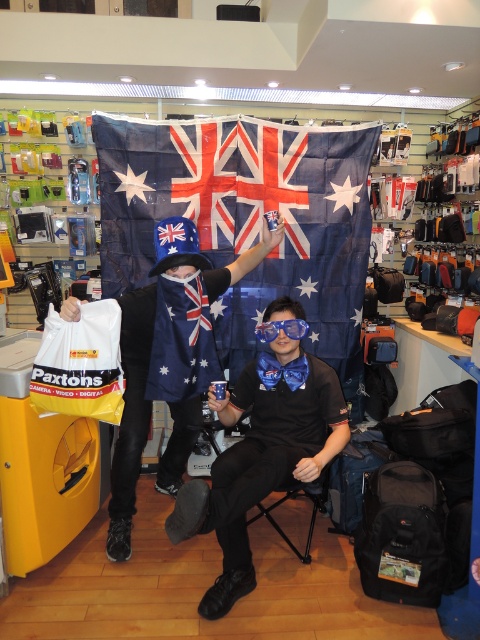
Does matte black shirt at center have a smaller size compared to blue fabric hat at center?

Correct, matte black shirt at center occupies less space than blue fabric hat at center.

Can you confirm if matte black shirt at center is wider than blue fabric hat at center?

No.

Does point (268, 413) come behind point (108, 557)?

No.

I want to click on matte black shirt at center, so click(261, 456).

What do you see at coordinates (248, 221) in the screenshot? The height and width of the screenshot is (640, 480). I see `blue fabric flag at center` at bounding box center [248, 221].

Does blue fabric flag at center have a larger size compared to blue glossy goggles at center?

Correct, blue fabric flag at center is larger in size than blue glossy goggles at center.

Identify the location of blue fabric flag at center. The width and height of the screenshot is (480, 640). (248, 221).

Locate an element on the screen. The width and height of the screenshot is (480, 640). blue fabric flag at center is located at coordinates (248, 221).

Is matte black shirt at center wider than blue glossy goggles at center?

Yes, matte black shirt at center is wider than blue glossy goggles at center.

Which is more to the right, matte black shirt at center or blue glossy goggles at center?

Positioned to the right is blue glossy goggles at center.

Consider the image. Who is more distant from viewer, (331, 376) or (283, 323)?

Positioned behind is point (331, 376).

Locate an element on the screen. matte black shirt at center is located at coordinates (261, 456).